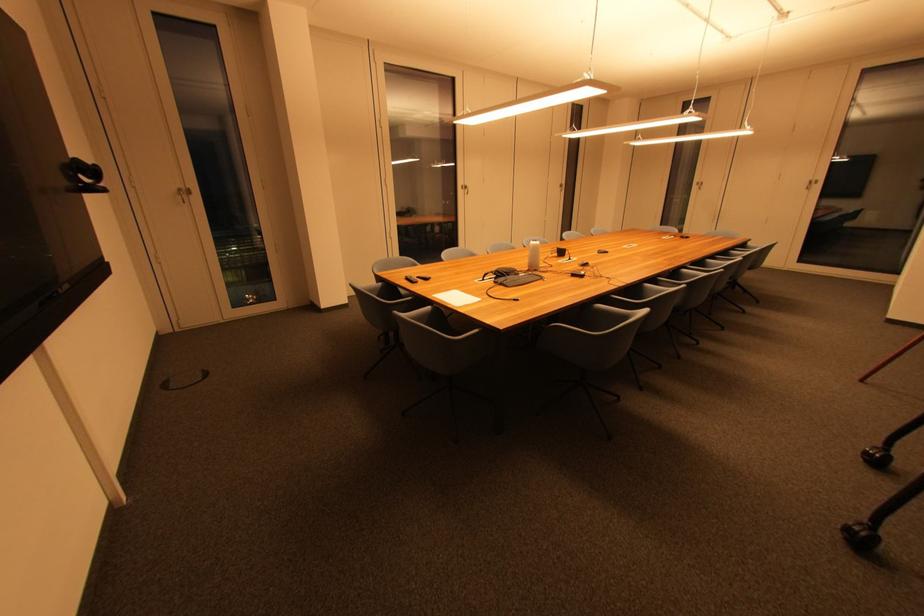
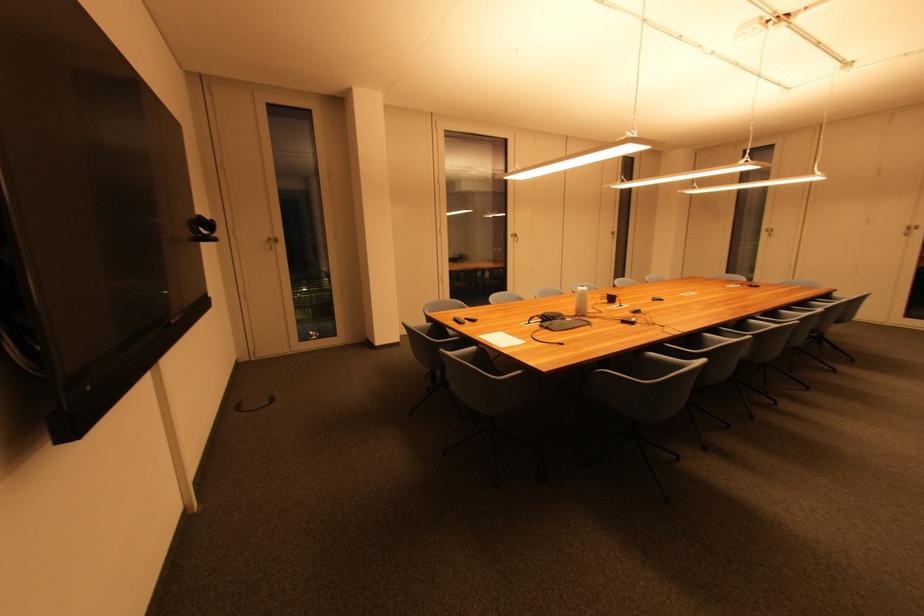
Question: The images are taken continuously from a first-person perspective. In which direction is your viewpoint rotating?

Choices:
 (A) Left
 (B) Right
 (C) Up
 (D) Down

Answer: (A)